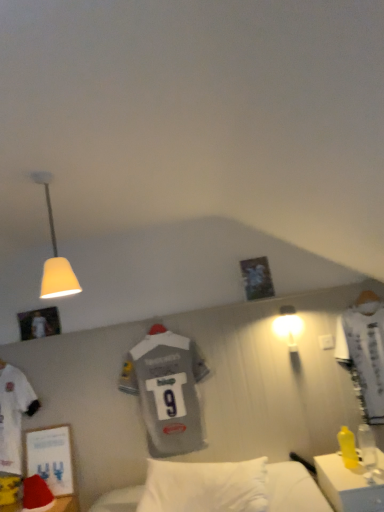
Question: Based on their sizes in the image, would you say matte white lampshade at upper left, which is the 1th lamp from top to bottom, is bigger or smaller than gray jersey at center?

Choices:
 (A) small
 (B) big

Answer: (A)

Question: From a real-world perspective, relative to gray jersey at center, is matte white lampshade at upper left, the second lamp positioned from the right, vertically above or below?

Choices:
 (A) below
 (B) above

Answer: (B)

Question: Estimate the real-world distances between objects in this image. Which object is closer to the gray jersey at center?

Choices:
 (A) matte white bulb at upper right, positioned as the second lamp in front-to-back order
 (B) matte white lampshade at upper left, the second lamp positioned from the right
 (C) yellow plastic desk at lower right

Answer: (A)

Question: Estimate the real-world distances between objects in this image. Which object is farther from the yellow plastic desk at lower right?

Choices:
 (A) gray jersey at center
 (B) matte white lampshade at upper left, which is the 2th lamp in bottom-to-top order
 (C) matte white bulb at upper right, the 2th lamp in the top-to-bottom sequence

Answer: (B)